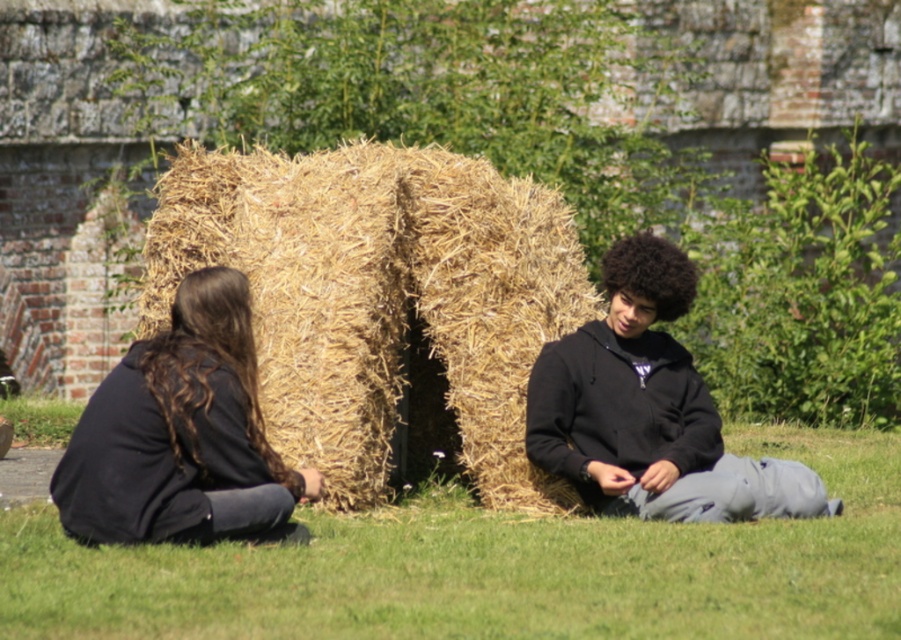
Question: Considering the relative positions of dark brown hair at left and black matte hoodie at center in the image provided, where is dark brown hair at left located with respect to black matte hoodie at center?

Choices:
 (A) right
 (B) left

Answer: (B)

Question: Based on their relative distances, which object is nearer to the black matte hoodie at center?

Choices:
 (A) dark brown hair at left
 (B) golden straw bale at center

Answer: (B)

Question: Which point is farther to the camera?

Choices:
 (A) (234, 193)
 (B) (207, 467)
 (C) (396, 516)
 (D) (660, 317)

Answer: (A)

Question: Among these objects, which one is farthest from the camera?

Choices:
 (A) green grass at lower center
 (B) golden straw bale at center

Answer: (B)

Question: Where is golden straw bale at center located in relation to dark brown hair at left in the image?

Choices:
 (A) below
 (B) above

Answer: (A)

Question: From the image, what is the correct spatial relationship of golden straw bale at center in relation to black matte hoodie at center?

Choices:
 (A) below
 (B) above

Answer: (A)